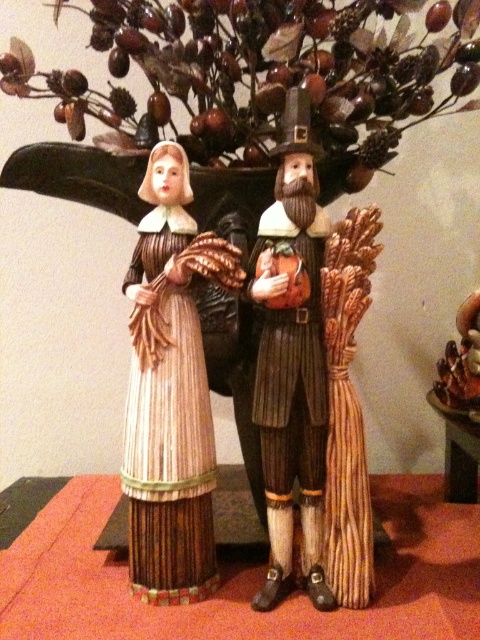
Question: Estimate the real-world distances between objects in this image. Which object is farther from the brown textured tree at upper center?

Choices:
 (A) wooden pilgrim at center
 (B) wooden table at lower right

Answer: (B)

Question: Does wooden straw doll at center have a greater width compared to wooden pilgrim at center?

Choices:
 (A) yes
 (B) no

Answer: (A)

Question: Does wooden table at center have a greater width compared to wooden straw doll at center?

Choices:
 (A) no
 (B) yes

Answer: (B)

Question: Is wooden pilgrim couple at center to the right of wooden table at lower right from the viewer's perspective?

Choices:
 (A) yes
 (B) no

Answer: (B)

Question: Which point is closer to the camera taking this photo?

Choices:
 (A) (301, 90)
 (B) (440, 54)
 (C) (445, 460)
 (D) (262, 259)

Answer: (D)

Question: Among these objects, which one is farthest from the camera?

Choices:
 (A) wooden straw doll at center
 (B) wooden table at lower right
 (C) wooden table at center

Answer: (B)